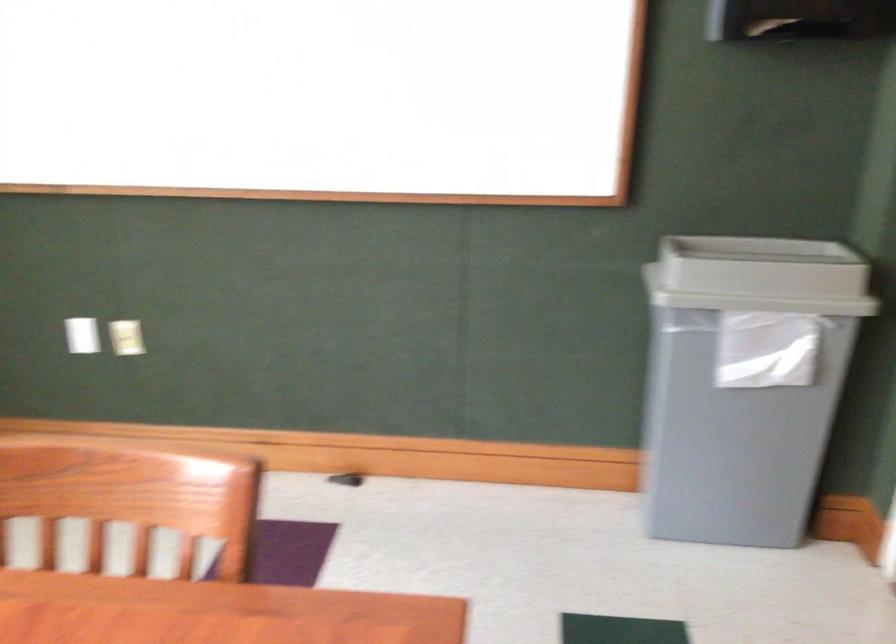
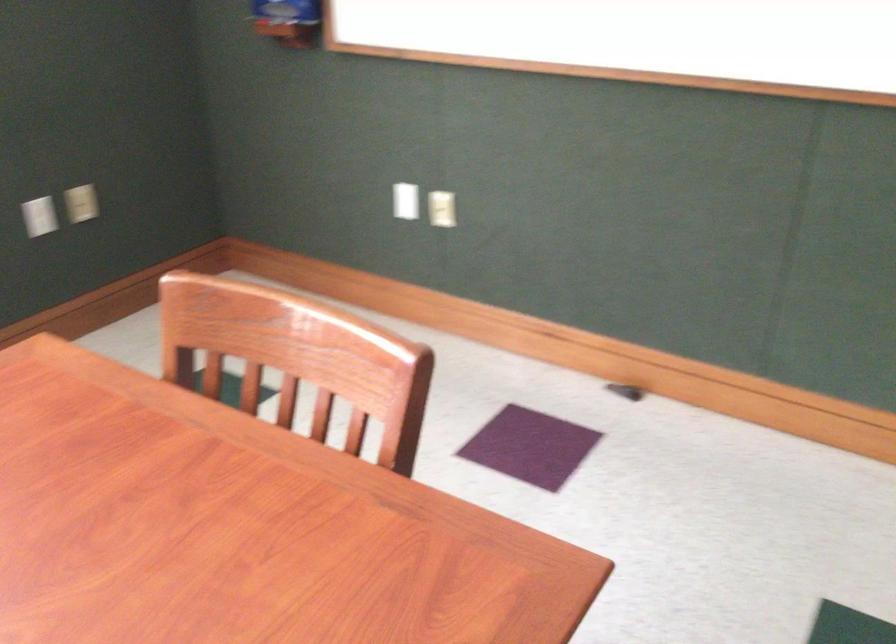
Question: Based on the continuous images, in which direction is the camera rotating? Reply with the corresponding letter.

Choices:
 (A) Left
 (B) Right
 (C) Up
 (D) Down

Answer: (A)